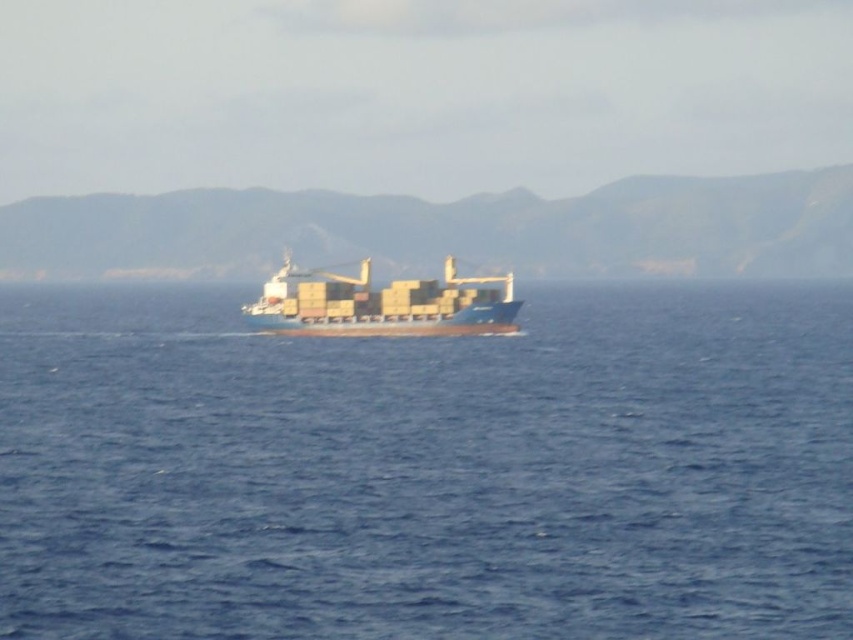
Does blue water at center have a smaller size compared to blue matte container ship at center?

Actually, blue water at center might be larger than blue matte container ship at center.

The width and height of the screenshot is (853, 640). I want to click on blue water at center, so click(428, 468).

Does point (643, 544) lie in front of point (381, 330)?

Yes, point (643, 544) is closer to viewer.

Find the location of a particular element. This screenshot has width=853, height=640. blue water at center is located at coordinates (428, 468).